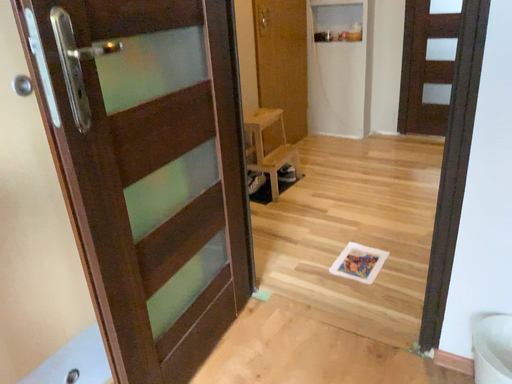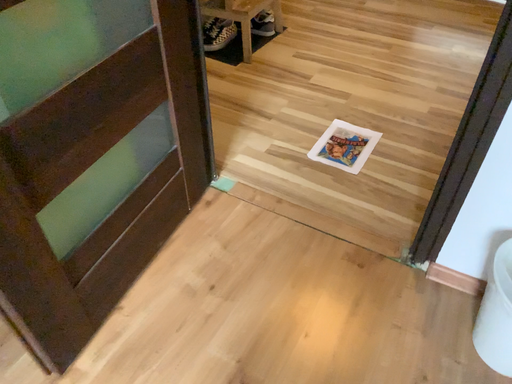
Question: Which way did the camera rotate in the video?

Choices:
 (A) rotated upward
 (B) rotated downward

Answer: (B)